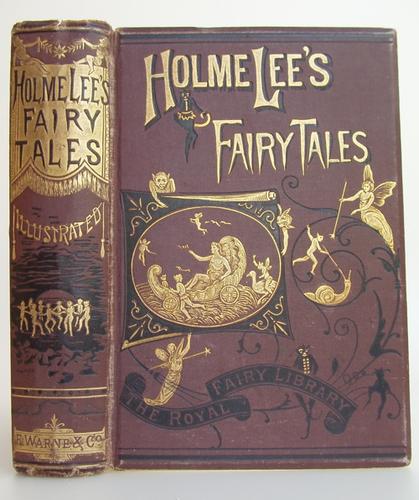
Find the location of `1 book cover`. 1 book cover is located at coordinates (285, 432).